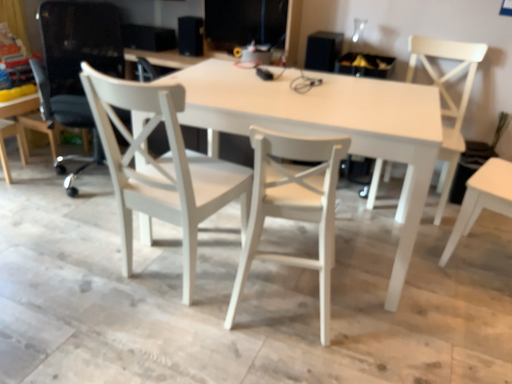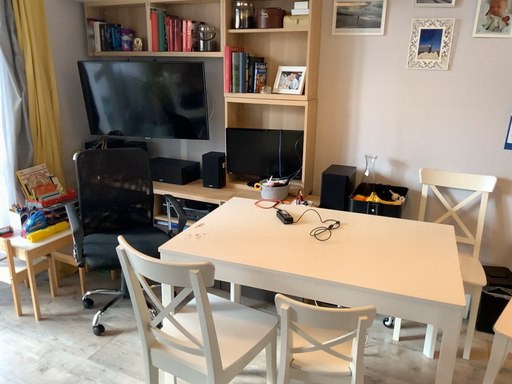
Question: How did the camera likely rotate when shooting the video?

Choices:
 (A) rotated upward
 (B) rotated downward

Answer: (A)